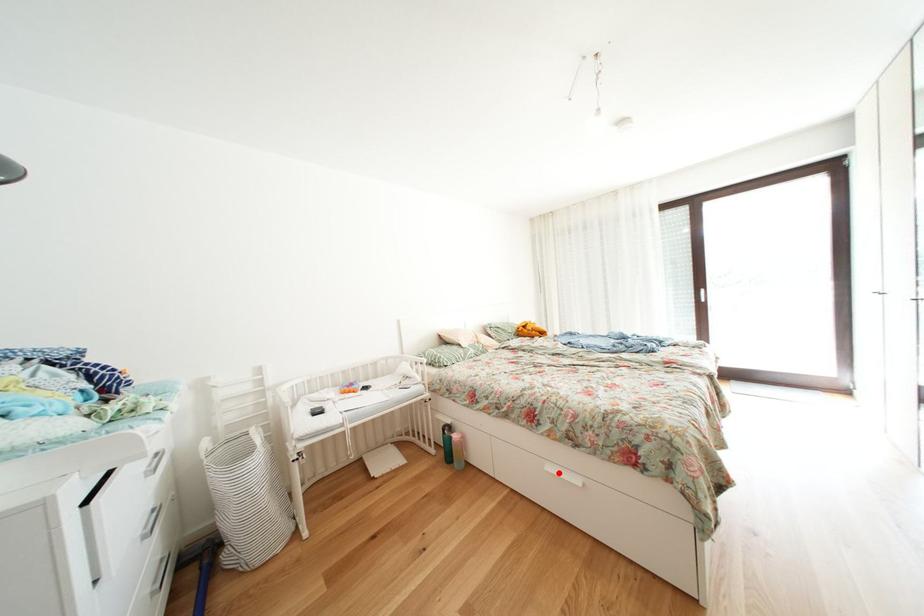
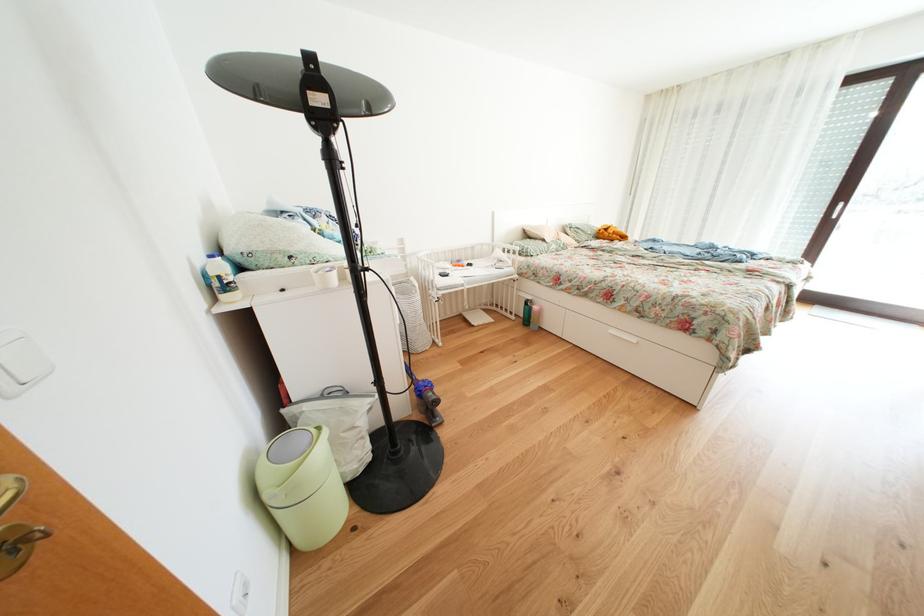
Where in the second image is the point corresponding to the highlighted location from the first image?

(622, 336)